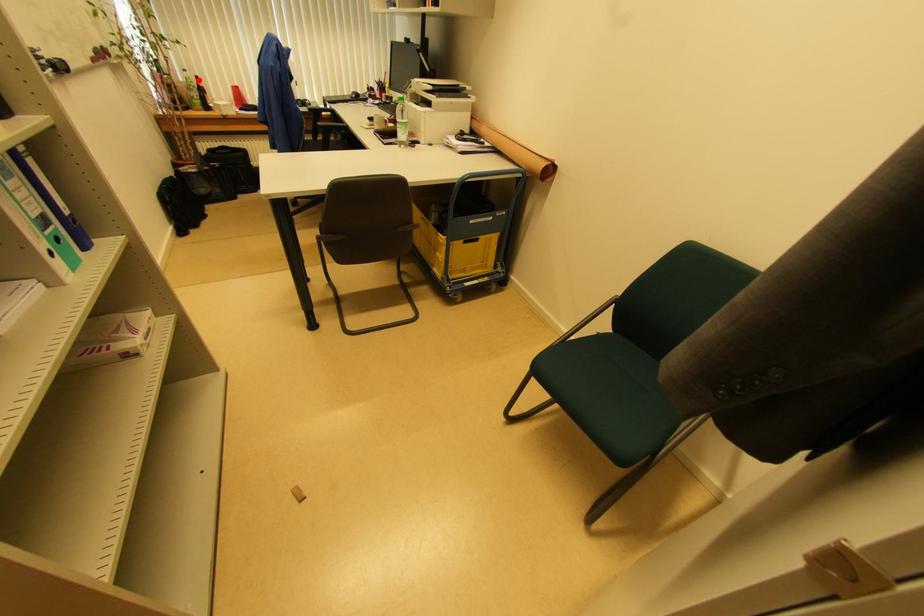
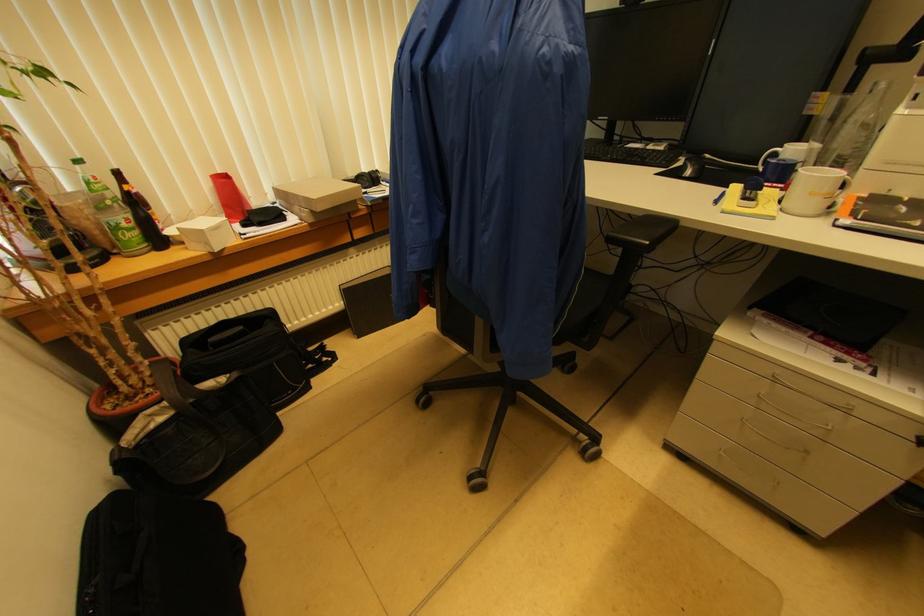
Where in the second image is the point corresponding to the highlighted location from the first image?

(118, 176)